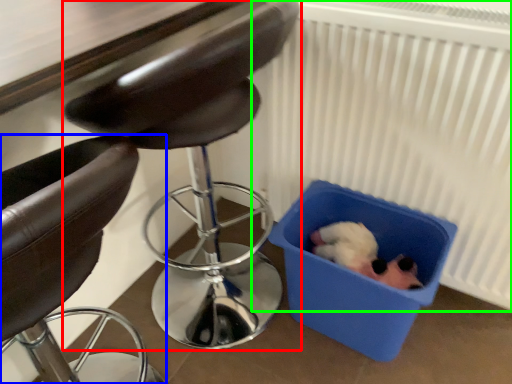
Question: Considering the real-world distances, which object is closest to chair (highlighted by a red box)? chair (highlighted by a blue box) or radiator (highlighted by a green box).

Choices:
 (A) chair
 (B) radiator

Answer: (B)